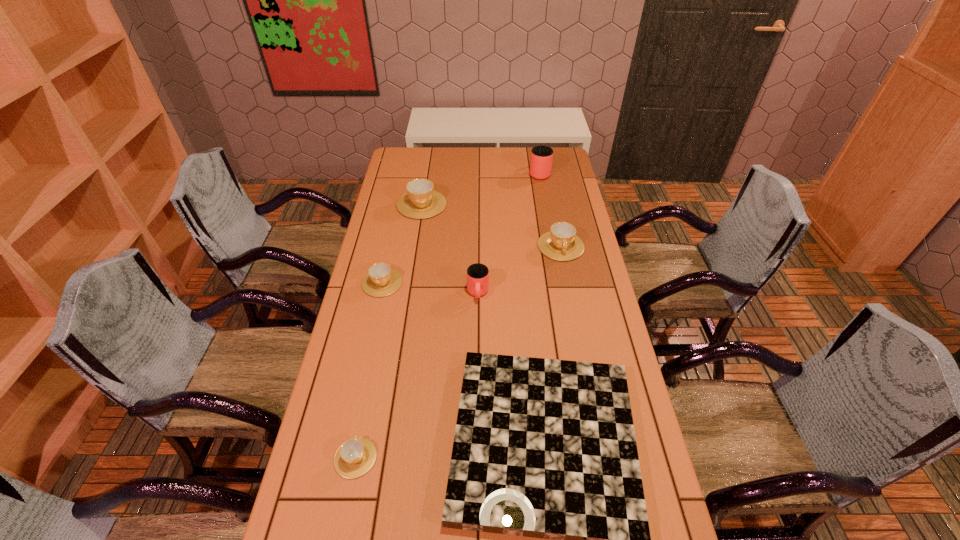
Locate which brown cup ranks in proximity to the fifth nearest cup. Please provide its 2D coordinates. Your answer should be formatted as a tuple, i.e. [(x, y)], where the tuple contains the x and y coordinates of a point satisfying the conditions above.

[(381, 280)]